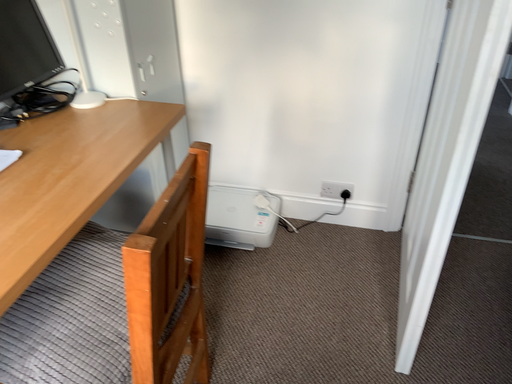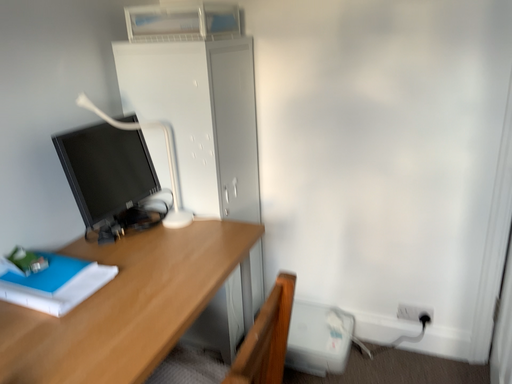
Question: Which way did the camera rotate in the video?

Choices:
 (A) rotated downward
 (B) rotated upward

Answer: (B)